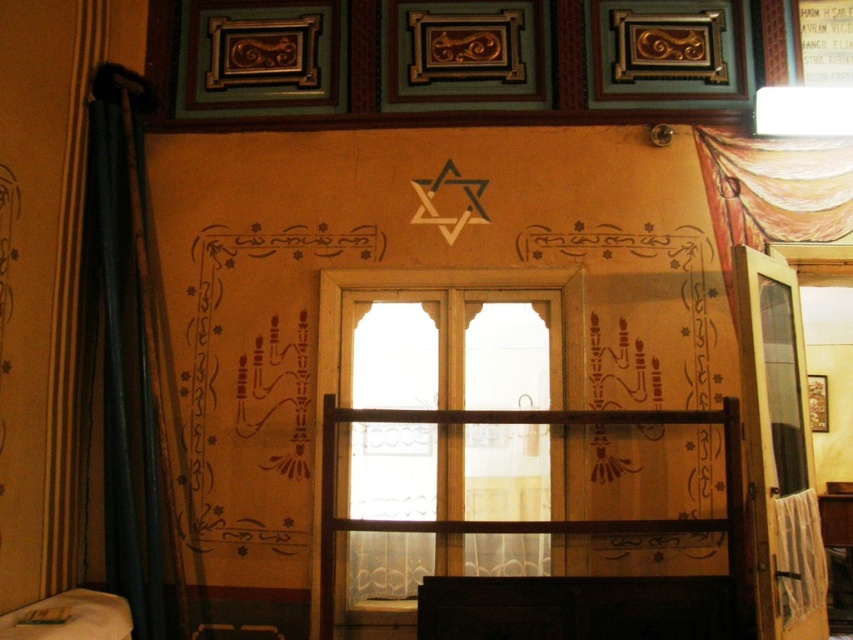
Question: Which of the following is the closest to the observer?

Choices:
 (A) (422, 520)
 (B) (753, 189)
 (C) (357, 460)

Answer: (A)

Question: Which of the following is the farthest from the observer?

Choices:
 (A) translucent fabric curtain at upper right
 (B) wooden at center

Answer: (A)

Question: Is wooden window at center to the left of wooden at center from the viewer's perspective?

Choices:
 (A) no
 (B) yes

Answer: (B)

Question: Considering the real-world distances, which object is closest to the wooden at center?

Choices:
 (A) beige fabric bed at lower left
 (B) translucent fabric curtain at upper right

Answer: (B)

Question: Is the position of wooden at center less distant than that of beige fabric bed at lower left?

Choices:
 (A) no
 (B) yes

Answer: (A)

Question: Can you confirm if wooden at center is wider than translucent fabric curtain at upper right?

Choices:
 (A) no
 (B) yes

Answer: (B)